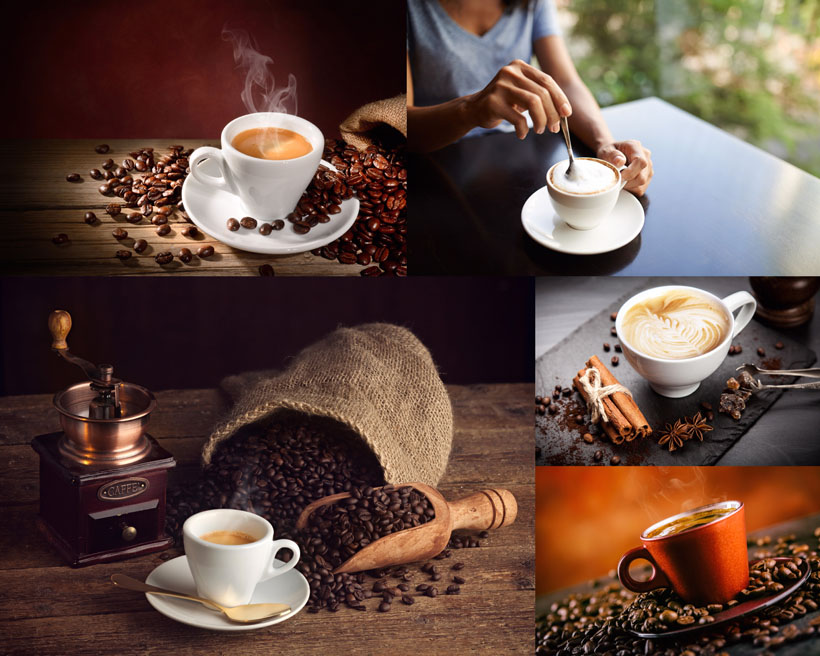
Locate an element on the screen. This screenshot has width=820, height=656. white cup handles, visible or partly visible is located at coordinates (193, 157), (749, 300), (294, 552), (622, 166).